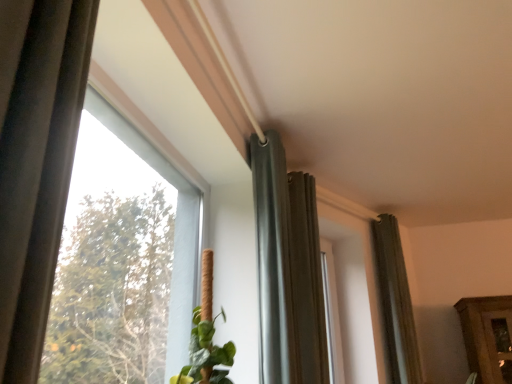
What do you see at coordinates (395, 302) in the screenshot? I see `dark gray fabric curtain at right, arranged as the 1th curtain when viewed from the right` at bounding box center [395, 302].

What do you see at coordinates (122, 260) in the screenshot?
I see `transparent glass window at upper left` at bounding box center [122, 260].

Identify the location of matte gray curtain at center, the second curtain when ordered from back to front. The image size is (512, 384). (307, 281).

Measure the distance between dark gray fabric curtain at center, the first curtain when ordered from left to right, and camera.

The depth of dark gray fabric curtain at center, the first curtain when ordered from left to right, is 1.78 meters.

Image resolution: width=512 pixels, height=384 pixels. What are the coordinates of `dark gray fabric curtain at right, arranged as the 1th curtain when viewed from the right` in the screenshot? It's located at (395, 302).

Looking at their sizes, would you say dark gray fabric curtain at center, which ranks as the 1th curtain in front-to-back order, is wider or thinner than transparent glass window at upper left?

Considering their sizes, dark gray fabric curtain at center, which ranks as the 1th curtain in front-to-back order, looks broader than transparent glass window at upper left.

This screenshot has height=384, width=512. In order to click on window directly beneath the dark gray fabric curtain at center, which ranks as the 1th curtain in front-to-back order (from a real-world perspective) in this screenshot , I will do pos(122,260).

Would you say dark gray fabric curtain at center, the first curtain when ordered from left to right, is inside or outside transparent glass window at upper left?

dark gray fabric curtain at center, the first curtain when ordered from left to right, lies outside transparent glass window at upper left.

Which is more to the left, dark gray fabric curtain at center, the 3th curtain when ordered from back to front, or transparent glass window at upper left?

From the viewer's perspective, transparent glass window at upper left appears more on the left side.

Does dark gray fabric curtain at center, positioned as the third curtain in right-to-left order, have a greater height compared to dark gray fabric curtain at right, the 3th curtain viewed from the left?

In fact, dark gray fabric curtain at center, positioned as the third curtain in right-to-left order, may be shorter than dark gray fabric curtain at right, the 3th curtain viewed from the left.

Which of these two, dark gray fabric curtain at center, positioned as the third curtain in right-to-left order, or dark gray fabric curtain at right, which is the 1th curtain in back-to-front order, is bigger?

dark gray fabric curtain at center, positioned as the third curtain in right-to-left order.

Looking at this image, relative to dark gray fabric curtain at right, which is the 1th curtain in back-to-front order, is dark gray fabric curtain at center, positioned as the third curtain in right-to-left order, in front or behind?

dark gray fabric curtain at center, positioned as the third curtain in right-to-left order, is positioned closer to the viewer than dark gray fabric curtain at right, which is the 1th curtain in back-to-front order.

Looking at this image, could you measure the distance between matte gray curtain at center, the 2th curtain when ordered from left to right, and transparent glass window at upper left?

matte gray curtain at center, the 2th curtain when ordered from left to right, and transparent glass window at upper left are 3.62 feet apart.

Which of these two, matte gray curtain at center, the 2th curtain when ordered from left to right, or transparent glass window at upper left, is smaller?

Smaller between the two is matte gray curtain at center, the 2th curtain when ordered from left to right.

Is matte gray curtain at center, the second curtain when ordered from back to front, located outside transparent glass window at upper left?

Yes.

Consider the image. From the image's perspective, is matte gray curtain at center, the second curtain when ordered from back to front, positioned above or below transparent glass window at upper left?

Clearly, from the image's perspective, matte gray curtain at center, the second curtain when ordered from back to front, is below transparent glass window at upper left.

From the image's perspective, who appears lower, transparent glass window at upper left or dark gray fabric curtain at right, the 3th curtain viewed from the left?

From the image's view, dark gray fabric curtain at right, the 3th curtain viewed from the left, is below.

Can you confirm if transparent glass window at upper left is wider than dark gray fabric curtain at right, the 3th curtain viewed from the left?

Incorrect, the width of transparent glass window at upper left does not surpass that of dark gray fabric curtain at right, the 3th curtain viewed from the left.

Between point (120, 258) and point (410, 316), which one is positioned in front?

The point (120, 258) is closer.

How many degrees apart are the facing directions of transparent glass window at upper left and dark gray fabric curtain at right, arranged as the 1th curtain when viewed from the right?

They differ by 22.3 degrees in their facing directions.

Can you confirm if dark gray fabric curtain at right, the 3th curtain viewed from the left, is thinner than transparent glass window at upper left?

Incorrect, the width of dark gray fabric curtain at right, the 3th curtain viewed from the left, is not less than that of transparent glass window at upper left.

Is dark gray fabric curtain at right, arranged as the 1th curtain when viewed from the right, inside the boundaries of transparent glass window at upper left, or outside?

dark gray fabric curtain at right, arranged as the 1th curtain when viewed from the right, is located beyond the bounds of transparent glass window at upper left.

Is dark gray fabric curtain at right, which ranks as the third curtain in front-to-back order, in front of transparent glass window at upper left?

No, it is not.

Based on the photo, how different are the orientations of dark gray fabric curtain at center, the 3th curtain when ordered from back to front, and matte gray curtain at center, the 2th curtain when ordered from left to right, in degrees?

The angle between the facing direction of dark gray fabric curtain at center, the 3th curtain when ordered from back to front, and the facing direction of matte gray curtain at center, the 2th curtain when ordered from left to right, is 11.4 degrees.

Could you tell me if dark gray fabric curtain at center, the first curtain when ordered from left to right, is facing matte gray curtain at center, which appears as the 2th curtain when viewed from the front?

No.

Does dark gray fabric curtain at center, which ranks as the 1th curtain in front-to-back order, have a greater width compared to matte gray curtain at center, the 2th curtain when ordered from left to right?

No, dark gray fabric curtain at center, which ranks as the 1th curtain in front-to-back order, is not wider than matte gray curtain at center, the 2th curtain when ordered from left to right.

Are matte gray curtain at center, which appears as the 2th curtain when viewed from the front, and dark gray fabric curtain at right, the 3th curtain viewed from the left, beside each other?

matte gray curtain at center, which appears as the 2th curtain when viewed from the front, and dark gray fabric curtain at right, the 3th curtain viewed from the left, are clearly separated.

Does point (307, 358) come farther from viewer compared to point (390, 256)?

That is False.

Is the position of matte gray curtain at center, the second curtain viewed from the right, less distant than that of dark gray fabric curtain at right, which ranks as the third curtain in front-to-back order?

Yes, the depth of matte gray curtain at center, the second curtain viewed from the right, is less than that of dark gray fabric curtain at right, which ranks as the third curtain in front-to-back order.

How different are the orientations of matte gray curtain at center, the 2th curtain when ordered from left to right, and dark gray fabric curtain at right, which ranks as the third curtain in front-to-back order, in degrees?

There is a 10.6-degree angle between the facing directions of matte gray curtain at center, the 2th curtain when ordered from left to right, and dark gray fabric curtain at right, which ranks as the third curtain in front-to-back order.

Locate an element on the screen. This screenshot has height=384, width=512. window below the dark gray fabric curtain at center, which ranks as the 1th curtain in front-to-back order (from a real-world perspective) is located at coordinates (122, 260).

At what (x,y) coordinates should I click in order to perform the action: click on the 2nd curtain below the dark gray fabric curtain at center, positioned as the third curtain in right-to-left order (from the image's perspective). Please return your answer as a coordinate pair (x, y). This screenshot has width=512, height=384. Looking at the image, I should click on (395, 302).

Estimate the real-world distances between objects in this image. Which object is closer to dark gray fabric curtain at center, the first curtain when ordered from left to right, transparent glass window at upper left or dark gray fabric curtain at right, which ranks as the third curtain in front-to-back order?

The object closer to dark gray fabric curtain at center, the first curtain when ordered from left to right, is transparent glass window at upper left.

From the image, which object appears to be farther from transparent glass window at upper left, dark gray fabric curtain at right, which ranks as the third curtain in front-to-back order, or dark gray fabric curtain at center, the 3th curtain when ordered from back to front?

Based on the image, dark gray fabric curtain at right, which ranks as the third curtain in front-to-back order, appears to be further to transparent glass window at upper left.

Estimate the real-world distances between objects in this image. Which object is further from dark gray fabric curtain at right, which is the 1th curtain in back-to-front order, transparent glass window at upper left or dark gray fabric curtain at center, the first curtain when ordered from left to right?

Based on the image, transparent glass window at upper left appears to be further to dark gray fabric curtain at right, which is the 1th curtain in back-to-front order.

Based on their spatial positions, is dark gray fabric curtain at center, the first curtain when ordered from left to right, or matte gray curtain at center, the second curtain when ordered from back to front, closer to transparent glass window at upper left?

dark gray fabric curtain at center, the first curtain when ordered from left to right, lies closer to transparent glass window at upper left than the other object.

In the scene shown: From the image, which object appears to be nearer to dark gray fabric curtain at right, arranged as the 1th curtain when viewed from the right, matte gray curtain at center, the second curtain when ordered from back to front, or transparent glass window at upper left?

The object closer to dark gray fabric curtain at right, arranged as the 1th curtain when viewed from the right, is matte gray curtain at center, the second curtain when ordered from back to front.

Considering their positions, is dark gray fabric curtain at right, which ranks as the third curtain in front-to-back order, positioned closer to matte gray curtain at center, the second curtain viewed from the right, than transparent glass window at upper left?

dark gray fabric curtain at right, which ranks as the third curtain in front-to-back order.

Consider the image. From the image, which object appears to be nearer to matte gray curtain at center, which appears as the 2th curtain when viewed from the front, transparent glass window at upper left or dark gray fabric curtain at right, arranged as the 1th curtain when viewed from the right?

Based on the image, dark gray fabric curtain at right, arranged as the 1th curtain when viewed from the right, appears to be nearer to matte gray curtain at center, which appears as the 2th curtain when viewed from the front.

Estimate the real-world distances between objects in this image. Which object is closer to transparent glass window at upper left, dark gray fabric curtain at right, which is the 1th curtain in back-to-front order, or matte gray curtain at center, the second curtain when ordered from back to front?

Based on the image, matte gray curtain at center, the second curtain when ordered from back to front, appears to be nearer to transparent glass window at upper left.

Locate an element on the screen. curtain located between transparent glass window at upper left and matte gray curtain at center, which appears as the 2th curtain when viewed from the front, in the depth direction is located at coordinates (288, 269).

Find the location of a particular element. The height and width of the screenshot is (384, 512). curtain between dark gray fabric curtain at center, the 3th curtain when ordered from back to front, and dark gray fabric curtain at right, which is the 1th curtain in back-to-front order, from front to back is located at coordinates (307, 281).